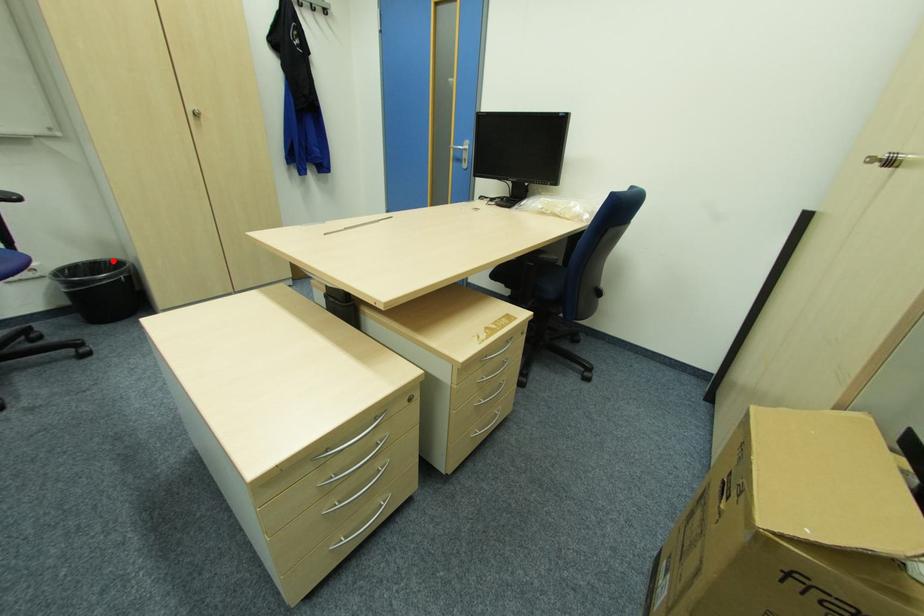
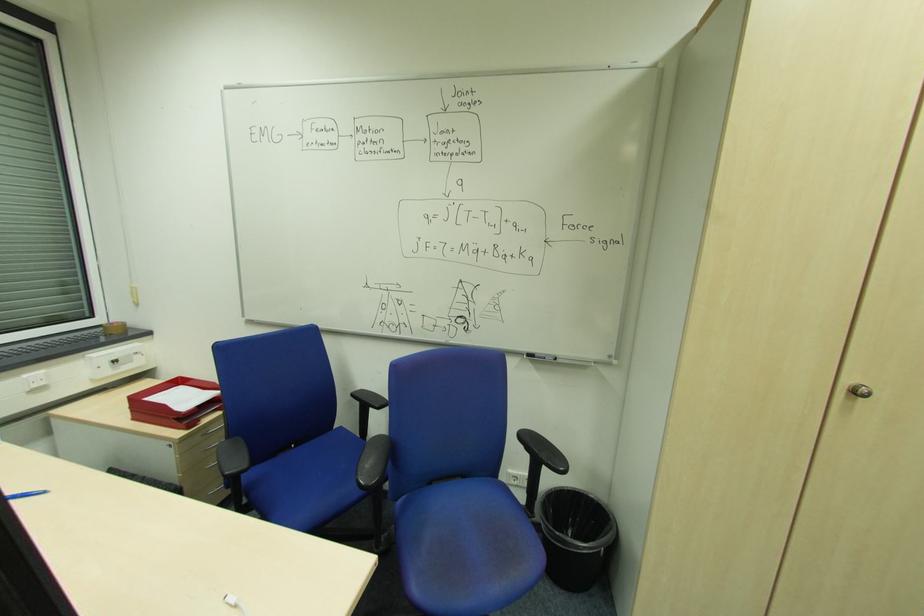
The point at the highlighted location is marked in the first image. Where is the corresponding point in the second image?

(594, 499)